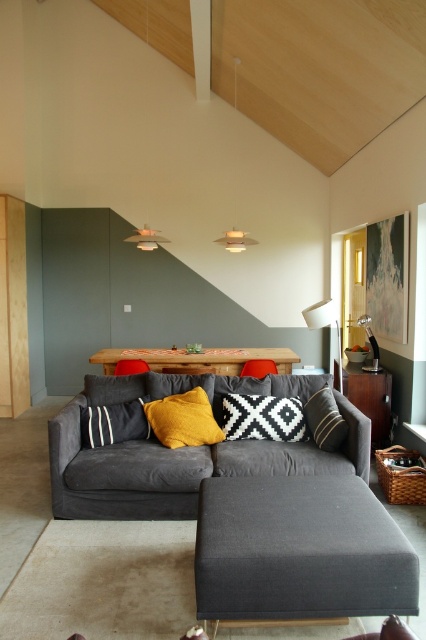
What is located at the point with coordinates (x=262, y=417) in the image?

The point at coordinates (x=262, y=417) corresponds to the black woven pillow at center.

You are planning to place a tall potted plant on either the matte fabric ottoman at center or the wooden side table at right. Based on their heights, which surface would be more stable for the plant?

The wooden side table at right is taller than the matte fabric ottoman at center, so placing the tall potted plant on the wooden side table at right would provide a more stable base due to its greater height and likely sturdier structure.

You are arranging a photo shoot in the living room and need to place two pillows on the sofa. The photographer wants to know which pillow is smaller between the black woven pillow at center and the yellow fabric pillow at center. Can you help determine this?

The black woven pillow at center has a smaller size compared to the yellow fabric pillow at center, so the black woven pillow at center is the smaller one.